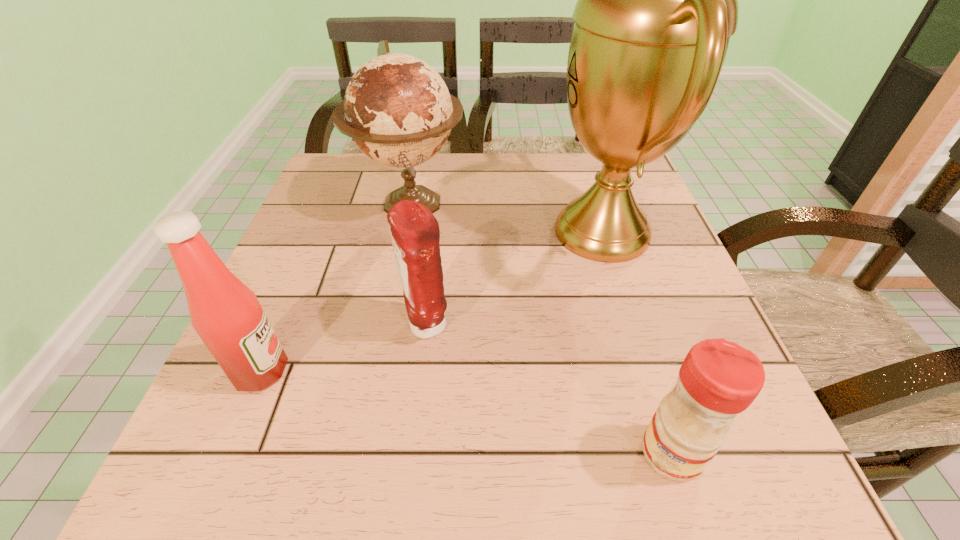
The width and height of the screenshot is (960, 540). I want to click on vacant area in the image that satisfies the following two spatial constraints: 1. on the front of the fourth shortest object showing Asia; 2. on the left side of the second condiment from right to left, so click(386, 327).

Identify the location of vacant area that satisfies the following two spatial constraints: 1. on the front of the nearest object showing Asia; 2. on the left side of the globe. Image resolution: width=960 pixels, height=540 pixels. (362, 453).

Locate an element on the screen. vacant space that satisfies the following two spatial constraints: 1. on the front-facing side of the tallest condiment; 2. on the right side of the nearest object is located at coordinates (227, 453).

The image size is (960, 540). Find the location of `vacant space that satisfies the following two spatial constraints: 1. on the front of the fourth shortest object showing Asia; 2. on the left side of the nearest object`. vacant space that satisfies the following two spatial constraints: 1. on the front of the fourth shortest object showing Asia; 2. on the left side of the nearest object is located at coordinates (362, 453).

You are a GUI agent. You are given a task and a screenshot of the screen. Output one action in this format:
    pyautogui.click(x=<x>, y=<y>)
    Task: Click on the free space that satisfies the following two spatial constraints: 1. on the front-facing side of the nearest object; 2. on the right side of the leftmost condiment
    Image resolution: width=960 pixels, height=540 pixels.
    Given the screenshot: What is the action you would take?
    pyautogui.click(x=227, y=453)

This screenshot has width=960, height=540. I want to click on vacant area that satisfies the following two spatial constraints: 1. on the front of the second tallest object showing Asia; 2. on the left side of the nearest object, so click(x=362, y=453).

Locate an element on the screen. The width and height of the screenshot is (960, 540). free point that satisfies the following two spatial constraints: 1. on the front-facing side of the nearest condiment; 2. on the left side of the third shortest object is located at coordinates (227, 453).

Locate an element on the screen. free space that satisfies the following two spatial constraints: 1. on the surface of the trophy cup with symbols; 2. on the front side of the nearest object is located at coordinates (673, 453).